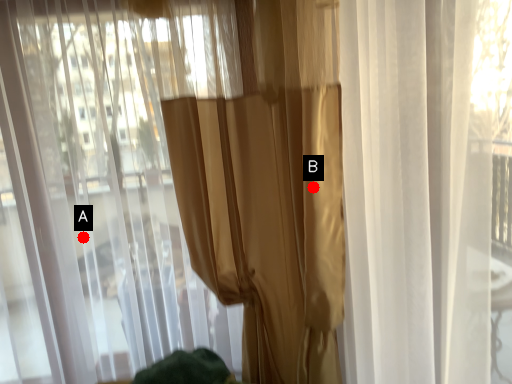
Question: Two points are circled on the image, labeled by A and B beside each circle. Among these points, which one is nearest to the camera?

Choices:
 (A) A is closer
 (B) B is closer

Answer: (B)